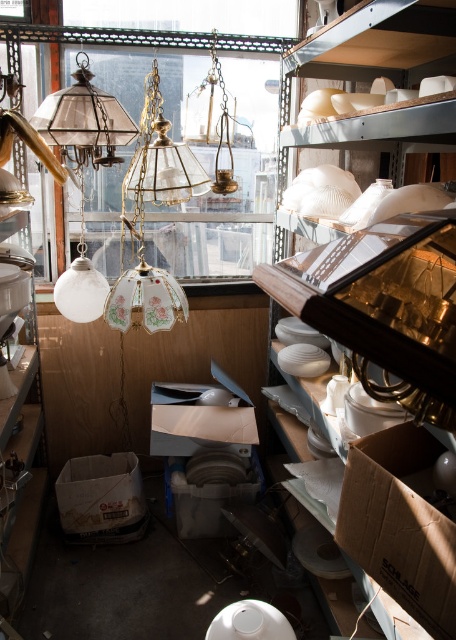
This screenshot has height=640, width=456. What do you see at coordinates (400, 524) in the screenshot?
I see `brown cardboard box at lower right` at bounding box center [400, 524].

This screenshot has width=456, height=640. Identify the location of brown cardboard box at lower right. (400, 524).

You are a GUI agent. You are given a task and a screenshot of the screen. Output one action in this format:
    pyautogui.click(x=<x>, y=<y>)
    Task: Click on the brown cardboard box at lower right
    This screenshot has height=640, width=456.
    Given the screenshot: What is the action you would take?
    pyautogui.click(x=400, y=524)

Does brown cardboard box at lower right appear over matte glass globe at left?

No, brown cardboard box at lower right is not above matte glass globe at left.

Based on the photo, between brown cardboard box at lower right and matte glass globe at left, which one is positioned higher?

matte glass globe at left is higher up.

Which is in front, point (409, 506) or point (67, 275)?

Point (409, 506) is in front.

The height and width of the screenshot is (640, 456). Find the location of `brown cardboard box at lower right`. brown cardboard box at lower right is located at coordinates (400, 524).

In the scene shown: How distant is clear glass lampshades at center from brown cardboard box at lower right?

clear glass lampshades at center is 6.45 feet from brown cardboard box at lower right.

Does clear glass lampshades at center have a lesser height compared to brown cardboard box at lower right?

In fact, clear glass lampshades at center may be taller than brown cardboard box at lower right.

Is point (244, 209) closer to viewer compared to point (409, 515)?

No, it is not.

Identify the location of clear glass lampshades at center. (231, 193).